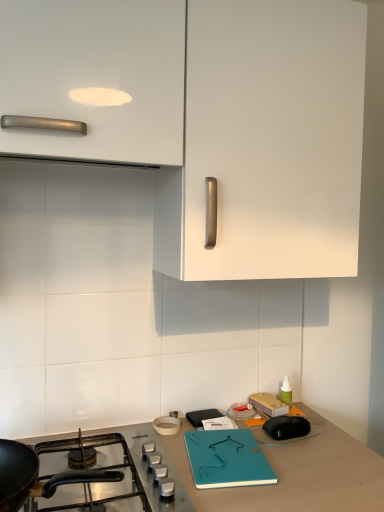
Question: Considering their positions, is white matte cabinet at upper center located in front of or behind black matte gas stove at lower left?

Choices:
 (A) behind
 (B) front

Answer: (A)

Question: From the image's perspective, relative to black matte gas stove at lower left, is white matte cabinet at upper center above or below?

Choices:
 (A) above
 (B) below

Answer: (A)

Question: Considering the positions of white matte cabinet at upper center and black matte gas stove at lower left in the image, is white matte cabinet at upper center wider or thinner than black matte gas stove at lower left?

Choices:
 (A) wide
 (B) thin

Answer: (A)

Question: In the image, is black matte gas stove at lower left positioned in front of or behind white matte cabinet at upper center?

Choices:
 (A) behind
 (B) front

Answer: (B)

Question: From a real-world perspective, is black matte gas stove at lower left above or below white matte cabinet at upper center?

Choices:
 (A) above
 (B) below

Answer: (B)

Question: Is point (87, 458) positioned closer to the camera than point (284, 261)?

Choices:
 (A) farther
 (B) closer

Answer: (B)

Question: Looking at the image, does black matte gas stove at lower left seem bigger or smaller compared to white matte cabinet at upper center?

Choices:
 (A) small
 (B) big

Answer: (A)